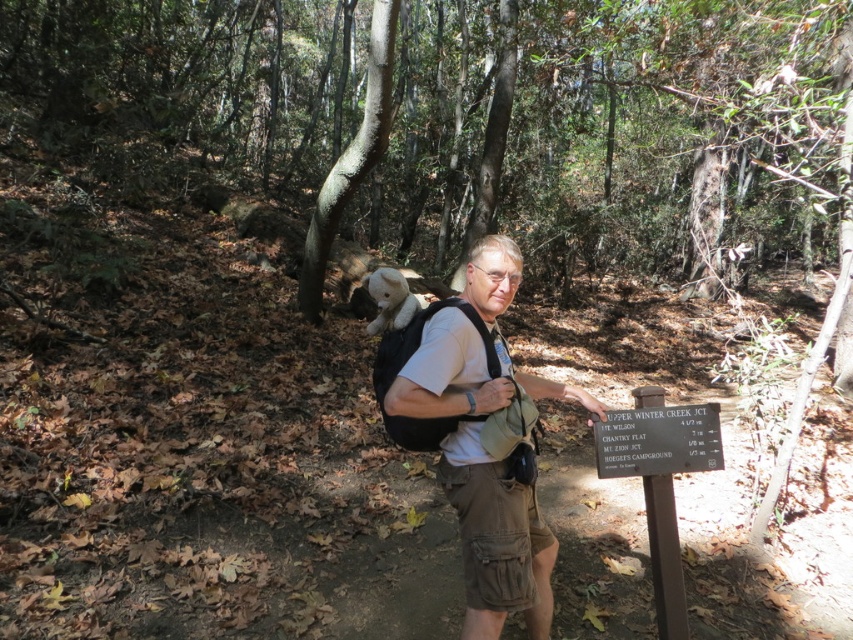
Is matte black backpack at center wider than black plastic sign at center?

Yes, matte black backpack at center is wider than black plastic sign at center.

Describe the element at coordinates (480, 445) in the screenshot. This screenshot has height=640, width=853. I see `matte black backpack at center` at that location.

Who is more forward, (514,276) or (619,452)?

Positioned in front is point (514,276).

This screenshot has height=640, width=853. Find the location of `matte black backpack at center`. matte black backpack at center is located at coordinates (480, 445).